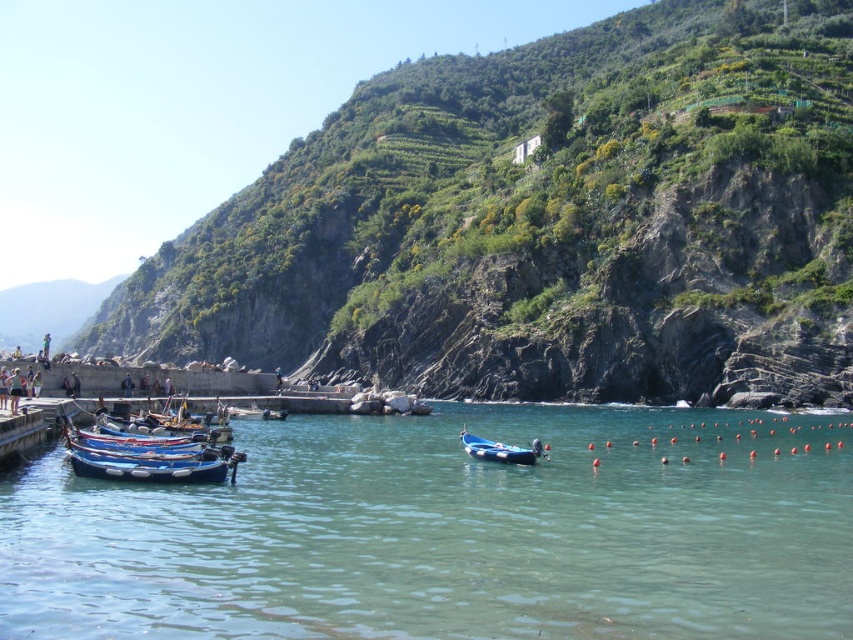
Question: Does blue glossy boat at lower left have a lesser width compared to wooden boat at lower left?

Choices:
 (A) no
 (B) yes

Answer: (A)

Question: Among these points, which one is nearest to the camera?

Choices:
 (A) (184, 477)
 (B) (376, 513)

Answer: (B)

Question: Is wooden boat at lower left to the left of blue rubber boat at center from the viewer's perspective?

Choices:
 (A) yes
 (B) no

Answer: (A)

Question: Estimate the real-world distances between objects in this image. Which object is farther from the blue glossy boat at lower left?

Choices:
 (A) blue rubber boat at center
 (B) green leafy hillside at upper center
 (C) clear blue water at center
 (D) wooden boat at lower left

Answer: (B)

Question: Which of the following is the closest to the observer?

Choices:
 (A) clear blue water at center
 (B) blue glossy boat at lower left
 (C) wooden boat at lower left
 (D) green leafy hillside at upper center

Answer: (A)

Question: Is blue glossy boat at lower left positioned behind wooden boat at lower left?

Choices:
 (A) no
 (B) yes

Answer: (B)